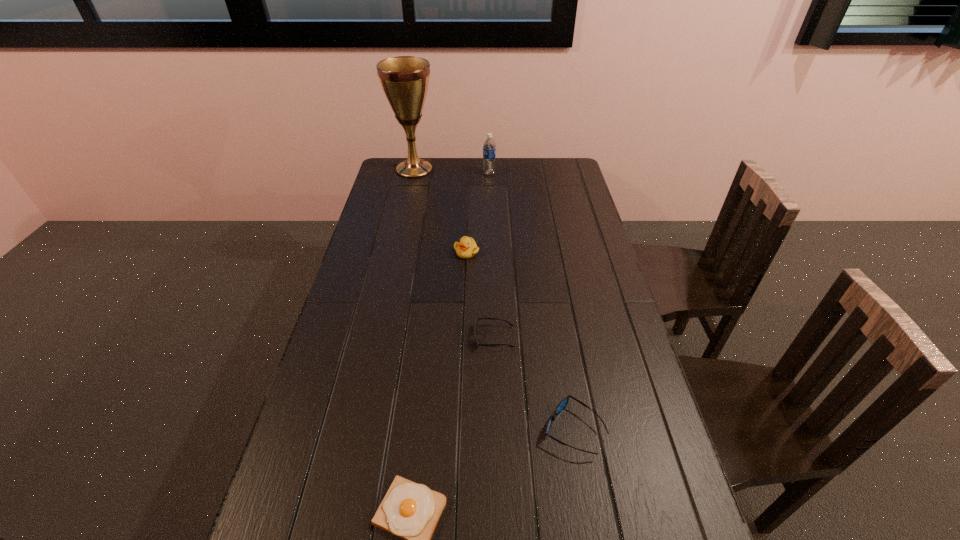
The height and width of the screenshot is (540, 960). I want to click on vacant position located 0.080m on the front-facing side of the third tallest object, so click(x=466, y=275).

I want to click on free space located at the front of the fifth farthest object showing the lenses, so click(485, 429).

You are a GUI agent. You are given a task and a screenshot of the screen. Output one action in this format:
    pyautogui.click(x=<x>, y=<y>)
    Task: Click on the blank space located at the front of the fifth farthest object showing the lenses
    The width and height of the screenshot is (960, 540).
    Given the screenshot: What is the action you would take?
    (514, 429)

This screenshot has width=960, height=540. Identify the location of vacant position located 0.130m at the front of the fifth farthest object showing the lenses. (489, 429).

Locate an element on the screen. This screenshot has width=960, height=540. vacant space situated on the front-facing side of the left sunglasses is located at coordinates (419, 338).

Image resolution: width=960 pixels, height=540 pixels. I want to click on vacant space positioned 0.080m on the front-facing side of the left sunglasses, so click(x=446, y=338).

Locate an element on the screen. This screenshot has width=960, height=540. vacant space situated 0.340m on the front-facing side of the left sunglasses is located at coordinates (357, 338).

I want to click on trophy cup at the far edge, so click(x=405, y=79).

Where is `water bottle situated at the far edge`? This screenshot has width=960, height=540. water bottle situated at the far edge is located at coordinates (489, 147).

Locate an element on the screen. The image size is (960, 540). object that is positioned at the left edge is located at coordinates (405, 79).